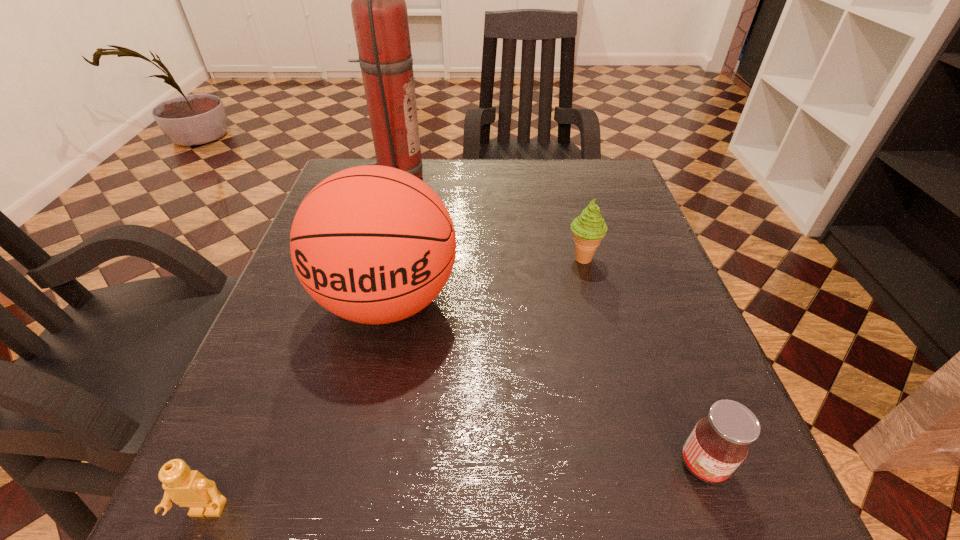
Where is `fire extinguisher`? The height and width of the screenshot is (540, 960). fire extinguisher is located at coordinates (379, 12).

This screenshot has height=540, width=960. Find the location of `the tallest object`. the tallest object is located at coordinates (379, 12).

Where is `the fourth shortest object`? The height and width of the screenshot is (540, 960). the fourth shortest object is located at coordinates (372, 244).

Where is `the second object from right to left`? This screenshot has width=960, height=540. the second object from right to left is located at coordinates (589, 228).

Where is `the third tallest object`? The image size is (960, 540). the third tallest object is located at coordinates (589, 228).

Find the location of a particular element. the rightmost object is located at coordinates (719, 443).

This screenshot has width=960, height=540. I want to click on the fourth farthest object, so click(x=719, y=443).

You are a GUI agent. You are given a task and a screenshot of the screen. Output one action in this format:
    pyautogui.click(x=<x>, y=<y>)
    Task: Click on the nearest object
    The height and width of the screenshot is (540, 960).
    Given the screenshot: What is the action you would take?
    pyautogui.click(x=189, y=488)

Where is `free location located 0.330m on the side of the tallest object with the label and nozzle`? Image resolution: width=960 pixels, height=540 pixels. free location located 0.330m on the side of the tallest object with the label and nozzle is located at coordinates tap(553, 178).

Find the location of a particular element. This screenshot has height=540, width=960. vacant space situated 0.070m on the side with logo of the basketball is located at coordinates (367, 395).